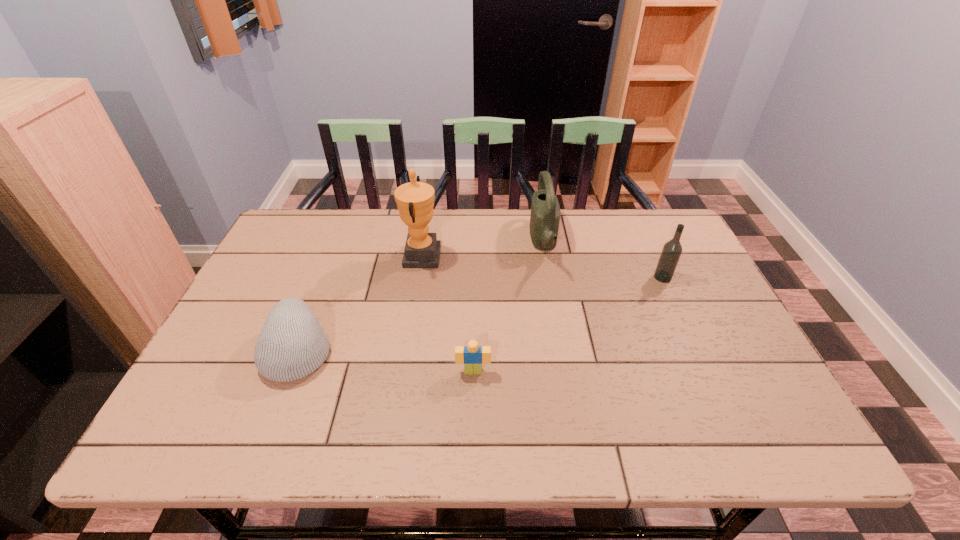
I want to click on vacant space at the near edge of the desktop, so click(284, 430).

Locate an element on the screen. This screenshot has width=960, height=540. vacant space at the right edge is located at coordinates (702, 319).

The height and width of the screenshot is (540, 960). In the image, there is a desktop. Find the location of `vacant space at the far left corner`. vacant space at the far left corner is located at coordinates coord(276,237).

Where is `vacant area at the near right corner`? vacant area at the near right corner is located at coordinates [778, 448].

Find the location of a particular element. Image resolution: width=960 pixels, height=540 pixels. vacant space in between the Lego and the rightmost object is located at coordinates (568, 324).

Image resolution: width=960 pixels, height=540 pixels. I want to click on free space between the award and the fourth tallest object, so click(x=360, y=303).

Where is `free point between the rightmost object and the award`? The width and height of the screenshot is (960, 540). free point between the rightmost object and the award is located at coordinates (542, 267).

Find the location of a particular element. Image resolution: width=960 pixels, height=540 pixels. empty space that is in between the shortest object and the tallest object is located at coordinates (447, 314).

Locate an element on the screen. empty space that is in between the Lego and the rightmost object is located at coordinates (568, 324).

You are a GUI agent. You are given a task and a screenshot of the screen. Output one action in this format:
    pyautogui.click(x=<x>, y=<y>)
    Task: Click on the vacant region between the second object from right to left and the leftmost object
    
    Given the screenshot: What is the action you would take?
    pyautogui.click(x=420, y=296)